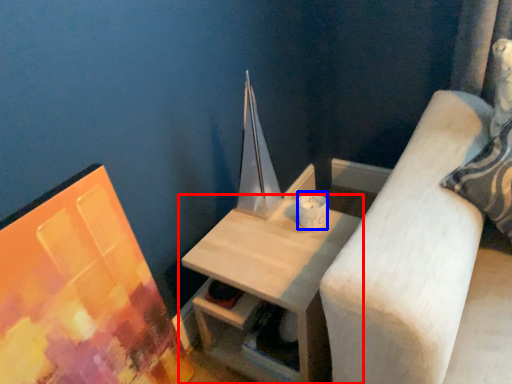
Question: Which object appears closest to the camera in this image, table (highlighted by a red box) or candle holder (highlighted by a blue box)?

Choices:
 (A) table
 (B) candle holder

Answer: (A)